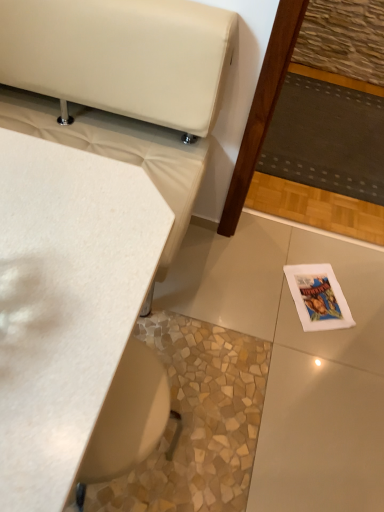
I want to click on vacant space positioned to the left of white paper magazine at lower right, so click(266, 286).